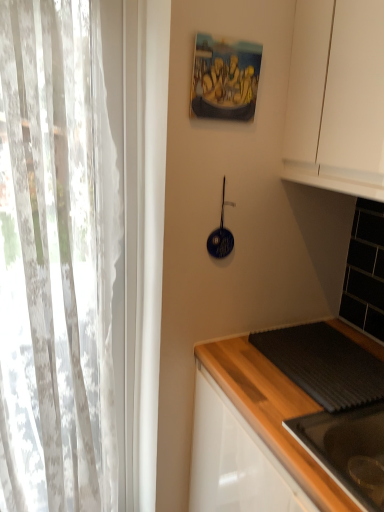
What do you see at coordinates (296, 371) in the screenshot? The height and width of the screenshot is (512, 384). I see `dark gray textured mat at lower right` at bounding box center [296, 371].

Find the location of a particular element. Image resolution: width=384 pixels, height=512 pixels. black glossy sink at lower right is located at coordinates (348, 450).

The height and width of the screenshot is (512, 384). Find the location of `blue glossy frying pan at upper center`. blue glossy frying pan at upper center is located at coordinates (221, 234).

At what (x,y) coordinates should I click in order to perform the action: click on white sheer curtain at left. Please return your answer as a coordinate pair (x, y). The image size is (384, 512). Looking at the image, I should click on (57, 257).

Are black glossy sink at lower right and dark gray textured mat at lower right beside each other?

No, black glossy sink at lower right is not touching dark gray textured mat at lower right.

From the image's perspective, which one is positioned higher, black glossy sink at lower right or dark gray textured mat at lower right?

dark gray textured mat at lower right.

Considering the sizes of objects black glossy sink at lower right and dark gray textured mat at lower right in the image provided, who is wider, black glossy sink at lower right or dark gray textured mat at lower right?

black glossy sink at lower right.

Where is `sink directly beneath the dark gray textured mat at lower right (from a real-world perspective)`? This screenshot has height=512, width=384. sink directly beneath the dark gray textured mat at lower right (from a real-world perspective) is located at coordinates (348, 450).

In the scene shown: From the image's perspective, which one is positioned lower, white sheer curtain at left or oil painting at upper center?

white sheer curtain at left.

This screenshot has width=384, height=512. Identify the location of curtain below the oil painting at upper center (from the image's perspective). (57, 257).

Is point (19, 331) in front of point (198, 78)?

That is False.

Is white sheer curtain at left inside or outside of oil painting at upper center?

white sheer curtain at left lies outside oil painting at upper center.

Is black glossy sink at lower right wider than white sheer curtain at left?

Yes.

Is black glossy sink at lower right oriented away from white sheer curtain at left?

No, black glossy sink at lower right is not facing the opposite direction of white sheer curtain at left.

Is black glossy sink at lower right not near blue glossy frying pan at upper center?

No, there isn't a large distance between black glossy sink at lower right and blue glossy frying pan at upper center.

Image resolution: width=384 pixels, height=512 pixels. Identify the location of sink on the right of the blue glossy frying pan at upper center. (348, 450).

From the image's perspective, which is below, black glossy sink at lower right or blue glossy frying pan at upper center?

black glossy sink at lower right, from the image's perspective.

Is blue glossy frying pan at upper center inside black glossy sink at lower right?

No, blue glossy frying pan at upper center is not inside black glossy sink at lower right.

Can you confirm if white sheer curtain at left is thinner than blue glossy frying pan at upper center?

In fact, white sheer curtain at left might be wider than blue glossy frying pan at upper center.

Can you see white sheer curtain at left touching blue glossy frying pan at upper center?

white sheer curtain at left and blue glossy frying pan at upper center are not in contact.

Is white sheer curtain at left bigger than blue glossy frying pan at upper center?

Yes.

Would you say white sheer curtain at left is to the left or to the right of blue glossy frying pan at upper center in the picture?

white sheer curtain at left is positioned on blue glossy frying pan at upper center's left side.

Is oil painting at upper center not near dark gray textured mat at lower right?

Actually, oil painting at upper center and dark gray textured mat at lower right are a little close together.

Is oil painting at upper center oriented away from dark gray textured mat at lower right?

No, dark gray textured mat at lower right is not at the back of oil painting at upper center.

How many degrees apart are the facing directions of oil painting at upper center and dark gray textured mat at lower right?

They differ by 92.2 degrees in their facing directions.

Does oil painting at upper center lie in front of dark gray textured mat at lower right?

No, oil painting at upper center is behind dark gray textured mat at lower right.

Is dark gray textured mat at lower right thinner than blue glossy frying pan at upper center?

In fact, dark gray textured mat at lower right might be wider than blue glossy frying pan at upper center.

From the image's perspective, who appears lower, dark gray textured mat at lower right or blue glossy frying pan at upper center?

dark gray textured mat at lower right, from the image's perspective.

From a real-world perspective, between dark gray textured mat at lower right and blue glossy frying pan at upper center, who is vertically lower?

From a 3D spatial view, dark gray textured mat at lower right is below.

Is dark gray textured mat at lower right in front of or behind blue glossy frying pan at upper center in the image?

dark gray textured mat at lower right is in front of blue glossy frying pan at upper center.

Identify the location of countertop above the black glossy sink at lower right (from a real-world perspective). This screenshot has height=512, width=384. (296, 371).

Find the location of a particular element. This screenshot has width=384, height=512. picture frame behind the white sheer curtain at left is located at coordinates (225, 79).

From the image, which object appears to be farther from oil painting at upper center, black glossy sink at lower right or white sheer curtain at left?

black glossy sink at lower right.

From the image, which object appears to be farther from dark gray textured mat at lower right, black glossy sink at lower right or oil painting at upper center?

Among the two, oil painting at upper center is located further to dark gray textured mat at lower right.

Based on their spatial positions, is white sheer curtain at left or dark gray textured mat at lower right further from blue glossy frying pan at upper center?

white sheer curtain at left is positioned further to the anchor blue glossy frying pan at upper center.

Based on the photo, based on their spatial positions, is black glossy sink at lower right or dark gray textured mat at lower right further from white sheer curtain at left?

Based on the image, black glossy sink at lower right appears to be further to white sheer curtain at left.

Which object lies further to the anchor point blue glossy frying pan at upper center, dark gray textured mat at lower right or white sheer curtain at left?

white sheer curtain at left is positioned further to the anchor blue glossy frying pan at upper center.

Which object lies nearer to the anchor point black glossy sink at lower right, blue glossy frying pan at upper center or dark gray textured mat at lower right?

dark gray textured mat at lower right.

Looking at the image, which one is located closer to blue glossy frying pan at upper center, oil painting at upper center or white sheer curtain at left?

The object closer to blue glossy frying pan at upper center is oil painting at upper center.

Estimate the real-world distances between objects in this image. Which object is closer to dark gray textured mat at lower right, black glossy sink at lower right or white sheer curtain at left?

black glossy sink at lower right lies closer to dark gray textured mat at lower right than the other object.

Find the location of a particular element. This screenshot has width=384, height=512. appliance situated between white sheer curtain at left and dark gray textured mat at lower right from left to right is located at coordinates (221, 234).

Identify the location of appliance between white sheer curtain at left and black glossy sink at lower right in the horizontal direction. Image resolution: width=384 pixels, height=512 pixels. (221, 234).

Identify the location of curtain between oil painting at upper center and dark gray textured mat at lower right in the up-down direction. The height and width of the screenshot is (512, 384). (57, 257).

You are a GUI agent. You are given a task and a screenshot of the screen. Output one action in this format:
    pyautogui.click(x=<x>, y=<y>)
    Task: Click on the countertop between white sheer curtain at left and black glossy sink at lower right in the horizontal direction
    The width and height of the screenshot is (384, 512).
    Given the screenshot: What is the action you would take?
    pyautogui.click(x=296, y=371)